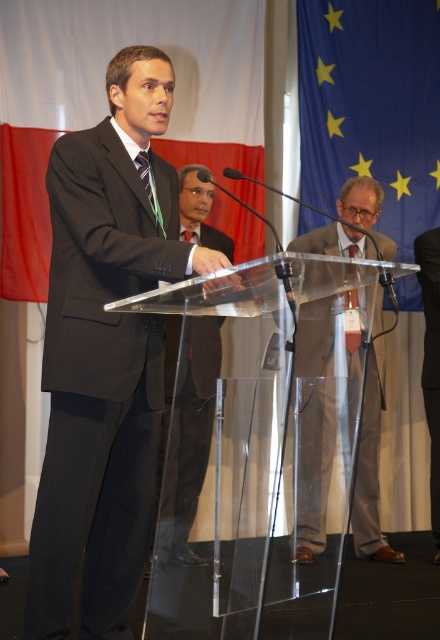
Can you confirm if black matte suit at center is thinner than black smooth suit at center?

Yes, black matte suit at center is thinner than black smooth suit at center.

Does black matte suit at center have a greater width compared to black smooth suit at center?

No, black matte suit at center is not wider than black smooth suit at center.

Which is behind, point (190, 406) or point (428, 275)?

The point (428, 275) is behind.

Where is `black matte suit at center`? This screenshot has height=640, width=440. black matte suit at center is located at coordinates (x=194, y=424).

Can you confirm if matte gray suit at center is shorter than black smooth suit at center?

Yes, matte gray suit at center is shorter than black smooth suit at center.

Can you confirm if matte gray suit at center is wider than black smooth suit at center?

Yes.

The width and height of the screenshot is (440, 640). Identify the location of matte gray suit at center. (370, 467).

Where is `matte gray suit at center`? The width and height of the screenshot is (440, 640). matte gray suit at center is located at coordinates (370, 467).

Based on the photo, is black matte suit at left wider than matte gray suit at center?

Correct, the width of black matte suit at left exceeds that of matte gray suit at center.

Based on the photo, can you confirm if black matte suit at left is shorter than matte gray suit at center?

In fact, black matte suit at left may be taller than matte gray suit at center.

The height and width of the screenshot is (640, 440). Describe the element at coordinates (99, 384) in the screenshot. I see `black matte suit at left` at that location.

Identify the location of black matte suit at left. click(x=99, y=384).